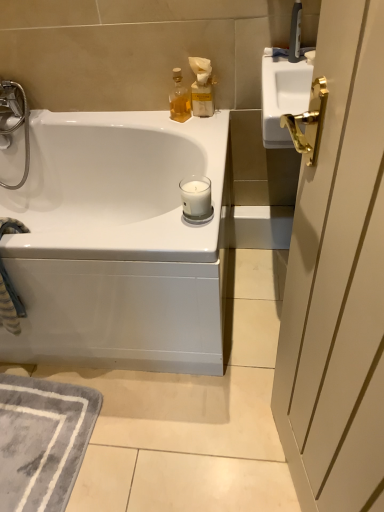
Where is `free spot above gray soft rug at lower left (from a real-world perspective)`? free spot above gray soft rug at lower left (from a real-world perspective) is located at coordinates (41, 430).